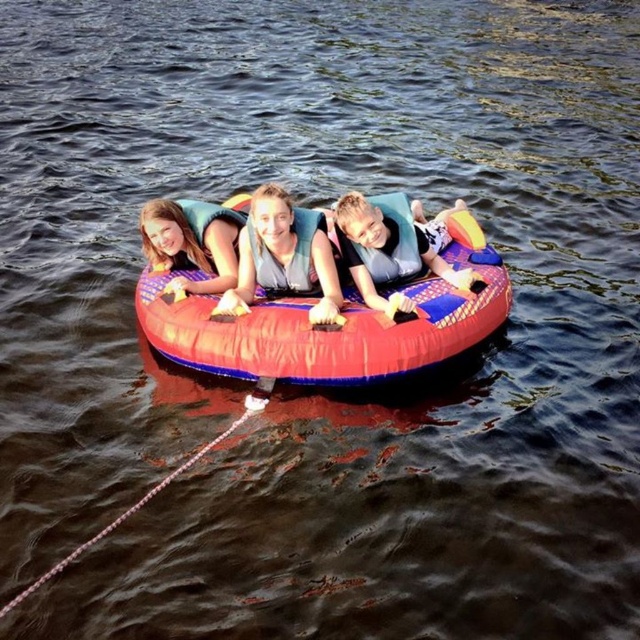
Who is more forward, (x=285, y=284) or (x=458, y=202)?

Point (x=285, y=284)

Between matte gray life vest at center and matte blue life vest at center, which one has more height?

Standing taller between the two is matte blue life vest at center.

Locate an element on the screen. matte gray life vest at center is located at coordinates (284, 257).

Is rubberized red tube at center below black matte life jacket at center?

Yes, rubberized red tube at center is below black matte life jacket at center.

Describe the element at coordinates (330, 326) in the screenshot. I see `rubberized red tube at center` at that location.

Identify the location of rubberized red tube at center. pyautogui.click(x=330, y=326).

Does point (372, 339) come in front of point (326, 268)?

Yes, it is in front of point (326, 268).

Between rubberized red tube at center and matte gray life vest at center, which one has less height?

matte gray life vest at center

Is point (173, 304) farther from viewer compared to point (243, 276)?

No, it is not.

Identify the location of rubberized red tube at center. This screenshot has height=640, width=640. (330, 326).